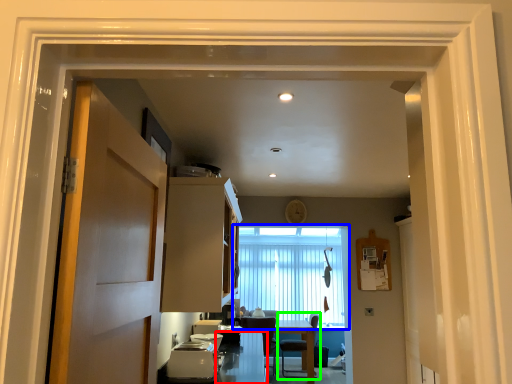
Question: Estimate the real-world distances between objects in this image. Which object is farther from counter top (highlighted by a red box), window (highlighted by a blue box) or chair (highlighted by a green box)?

Choices:
 (A) window
 (B) chair

Answer: (B)